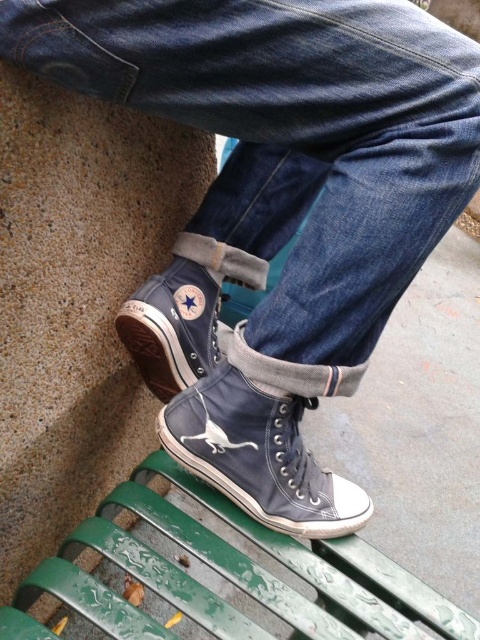
Question: Estimate the real-world distances between objects in this image. Which object is farther from the denim at center?

Choices:
 (A) canvas high-top sneaker at center
 (B) canvas high-top shoe at center

Answer: (A)

Question: In this image, where is green painted wood park bench at lower center located relative to canvas high-top shoe at center?

Choices:
 (A) above
 (B) below

Answer: (B)

Question: Among these objects, which one is farthest from the camera?

Choices:
 (A) denim at center
 (B) canvas high-top shoe at center
 (C) canvas high-top sneaker at center

Answer: (B)

Question: Does canvas high-top sneaker at center lie in front of canvas high-top shoe at center?

Choices:
 (A) yes
 (B) no

Answer: (A)

Question: Is denim at center smaller than green painted wood park bench at lower center?

Choices:
 (A) yes
 (B) no

Answer: (B)

Question: Which object is positioned farthest from the denim at center?

Choices:
 (A) green painted wood park bench at lower center
 (B) canvas high-top sneaker at center

Answer: (A)